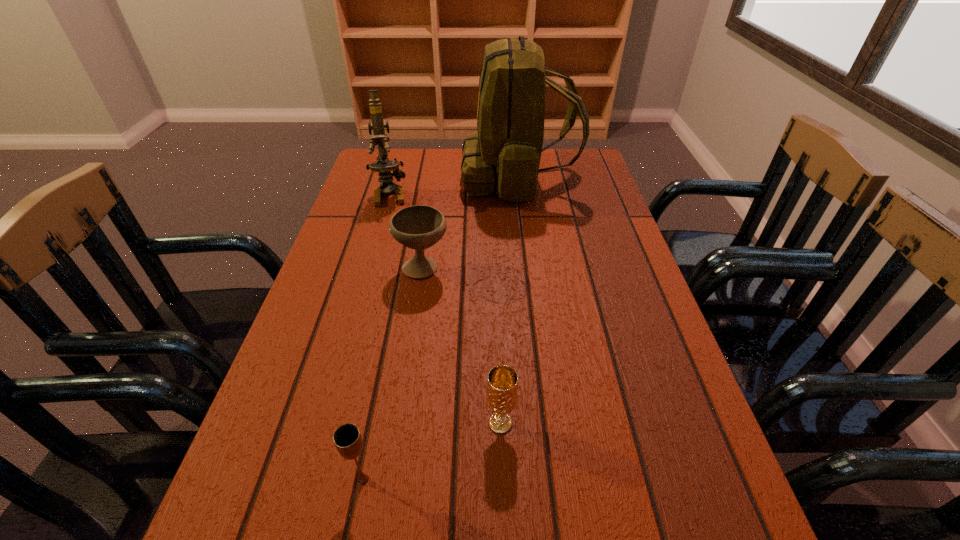
At what (x,y) coordinates should I click in order to perform the action: click on free space located 0.190m on the right of the microscope. Please return your answer as a coordinate pair (x, y). Looking at the image, I should click on (471, 194).

Find the location of a particular element. Image resolution: width=960 pixels, height=540 pixels. vacant space located on the front of the farthest chalice is located at coordinates (399, 423).

The width and height of the screenshot is (960, 540). In order to click on free space located on the back of the nearest object in this screenshot , I will do (x=389, y=348).

This screenshot has width=960, height=540. In order to click on free spot located on the right of the fourth farthest object in this screenshot , I will do `click(690, 422)`.

This screenshot has height=540, width=960. Identify the location of backpack located at the far edge. (505, 152).

Identify the location of microscope positioned at the far edge. This screenshot has height=540, width=960. (384, 166).

This screenshot has height=540, width=960. I want to click on object at the left edge, so click(384, 166).

In order to click on object located in the right edge section of the desktop in this screenshot , I will do `click(505, 152)`.

This screenshot has height=540, width=960. I want to click on object located at the far left corner, so click(384, 166).

The image size is (960, 540). What are the coordinates of `object that is at the far right corner` in the screenshot? It's located at (505, 152).